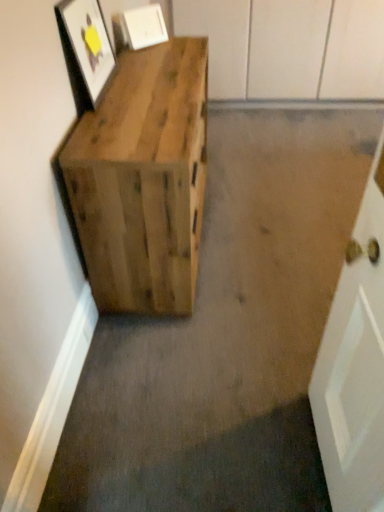
Question: From their relative heights in the image, would you say matte wooden picture frame at upper left, which is the 2th picture frame in back-to-front order, is taller or shorter than natural wood crate at left?

Choices:
 (A) short
 (B) tall

Answer: (A)

Question: In terms of width, does matte wooden picture frame at upper left, which is the 2th picture frame in back-to-front order, look wider or thinner when compared to natural wood crate at left?

Choices:
 (A) thin
 (B) wide

Answer: (A)

Question: Which of these objects is positioned farthest from the natural wood crate at left?

Choices:
 (A) matte wooden picture frame at upper left, which is the 2th picture frame in back-to-front order
 (B) matte white picture frame at upper center, the first picture frame viewed from the back

Answer: (B)

Question: Considering the real-world distances, which object is closest to the matte wooden picture frame at upper left, which is the 2th picture frame in back-to-front order?

Choices:
 (A) matte white picture frame at upper center, the first picture frame viewed from the back
 (B) natural wood crate at left

Answer: (B)